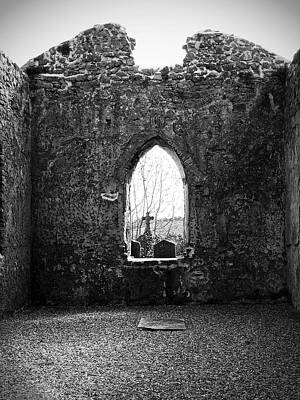
What are the coordinates of `floor` in the screenshot? It's located at (147, 366).